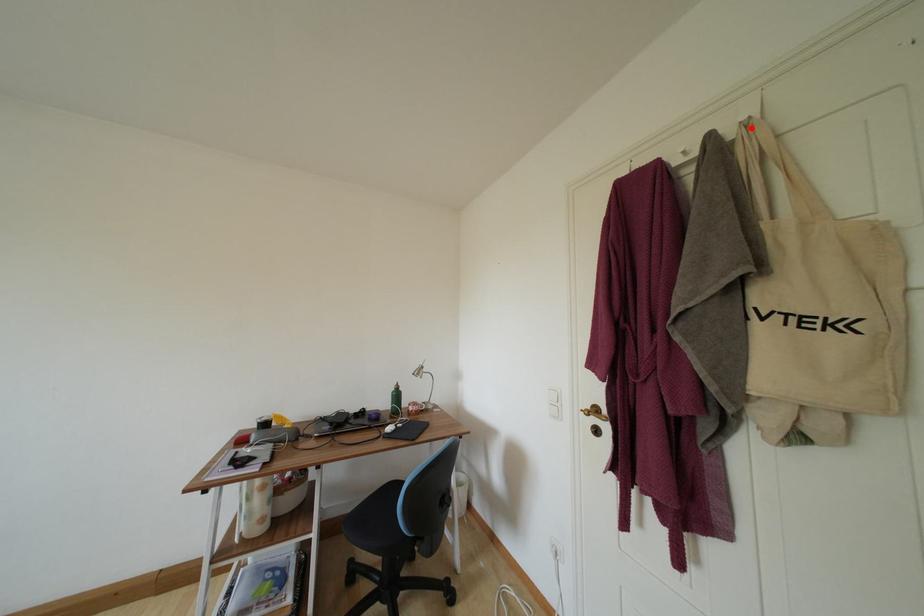
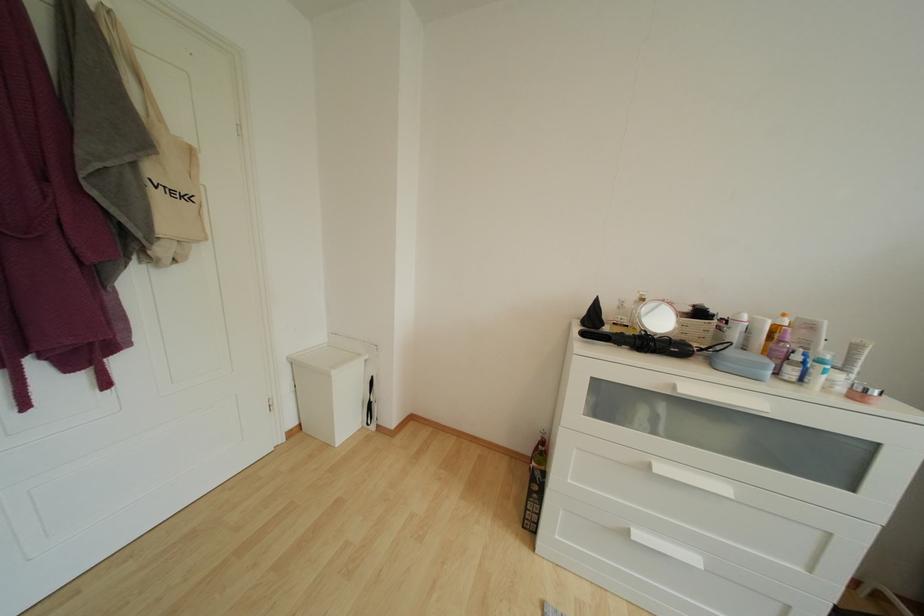
Where in the second image is the point corresponding to the highlighted location from the first image?

(114, 15)